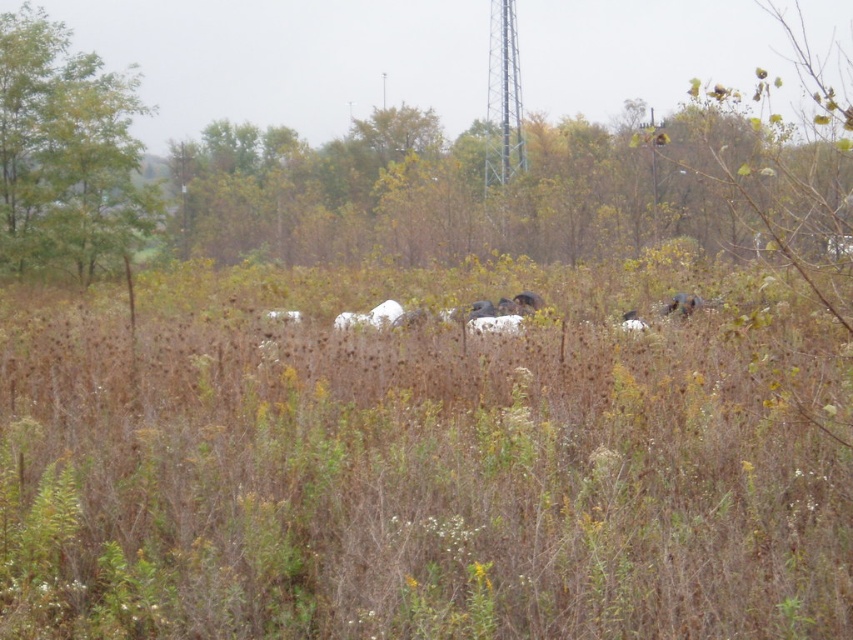
You are standing at the origin point of the coordinate system in the image. You want to move towards the white matte hay bales at center. In which direction should you move?

The white matte hay bales at center are located at coordinate point (424, 458). Since you are at the origin, you should move in the positive x and positive y direction to reach them.